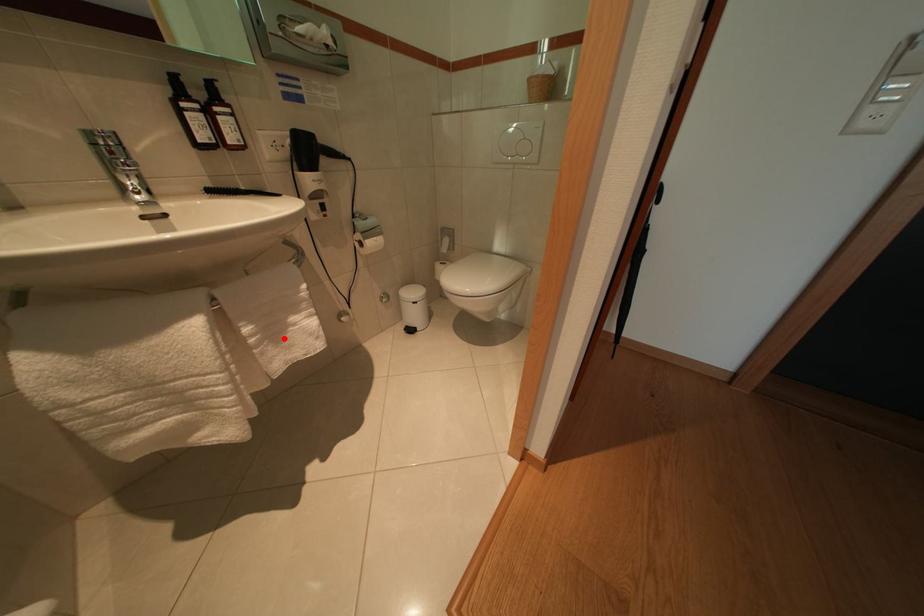
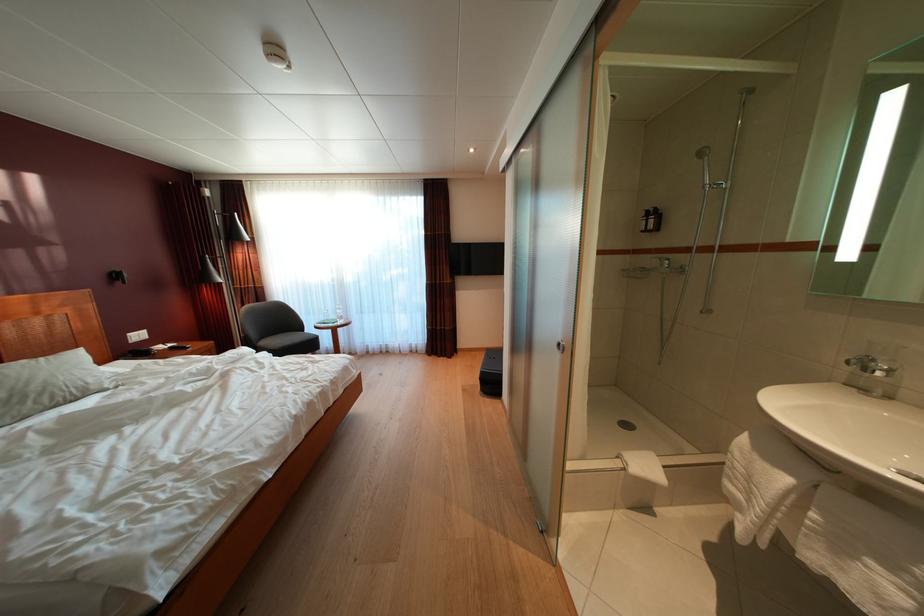
Find the pixel in the second image that matches the highlighted location in the first image.

(849, 554)